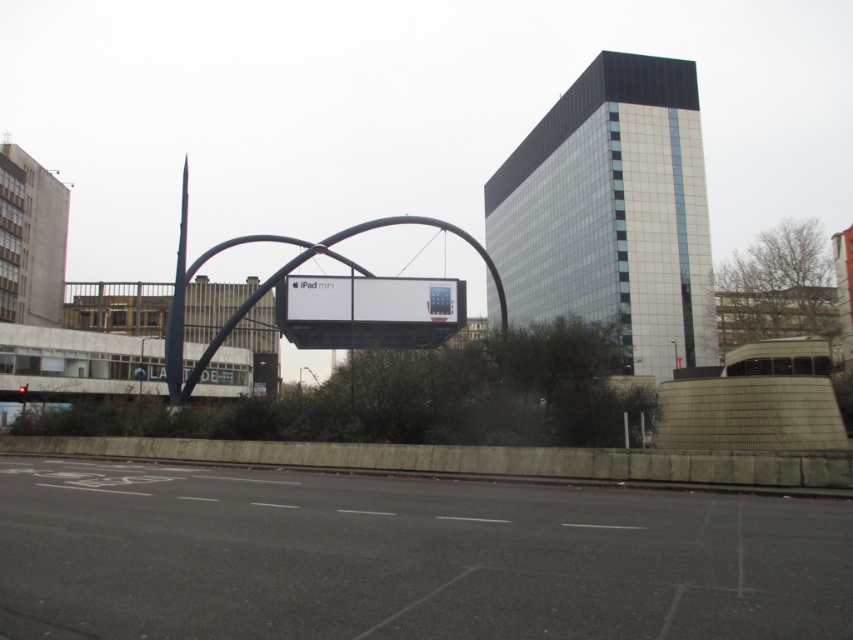
Who is positioned more to the left, white glossy ipad mini at center or metallic archway at center?

From the viewer's perspective, metallic archway at center appears more on the left side.

Consider the image. Is white glossy ipad mini at center closer to camera compared to metallic archway at center?

No, it is behind metallic archway at center.

In the scene shown: Measure the distance between point (321, 317) and camera.

A distance of 188.53 feet exists between point (321, 317) and camera.

Locate an element on the screen. This screenshot has height=640, width=853. white glossy ipad mini at center is located at coordinates (405, 300).